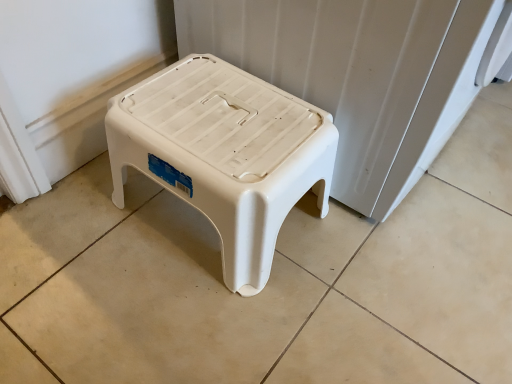
Identify the location of vacant area that is in front of white plastic stool at center. The height and width of the screenshot is (384, 512). (193, 323).